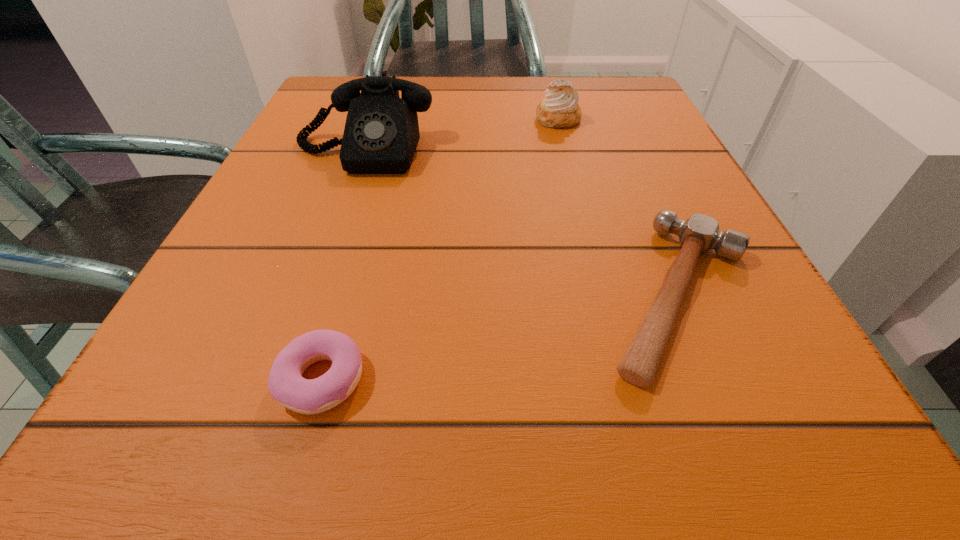
At what (x,y) coordinates should I click in order to perform the action: click on free space that satisfies the following two spatial constraints: 1. on the dial of the hammer; 2. on the left side of the tallest object. Please return your answer as a coordinate pair (x, y). The width and height of the screenshot is (960, 540). Looking at the image, I should click on point(313,295).